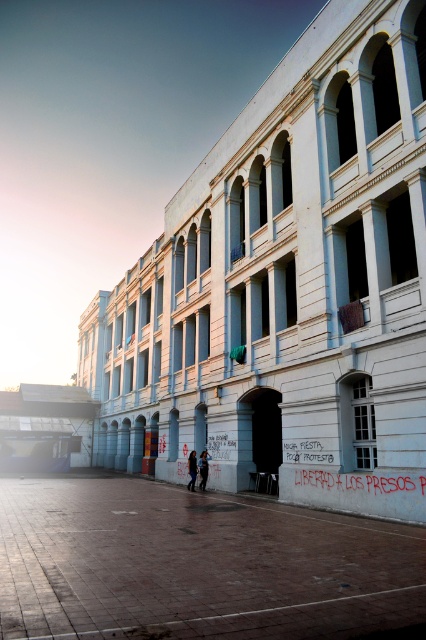
Question: Does blue denim jacket at center have a smaller size compared to dark blue jeans at center?

Choices:
 (A) no
 (B) yes

Answer: (A)

Question: Can you confirm if smooth concrete plaza at center is positioned to the right of dark blue jeans at center?

Choices:
 (A) yes
 (B) no

Answer: (A)

Question: Can you confirm if smooth concrete plaza at center is smaller than dark blue jeans at center?

Choices:
 (A) yes
 (B) no

Answer: (B)

Question: Which object appears closest to the camera in this image?

Choices:
 (A) blue denim jacket at center
 (B) smooth concrete plaza at center

Answer: (B)

Question: Which object is closer to the camera taking this photo?

Choices:
 (A) blue denim jacket at center
 (B) smooth concrete plaza at center
 (C) dark blue jeans at center

Answer: (B)

Question: Which point is closer to the camera?

Choices:
 (A) (201, 464)
 (B) (187, 472)
 (C) (299, 602)

Answer: (C)